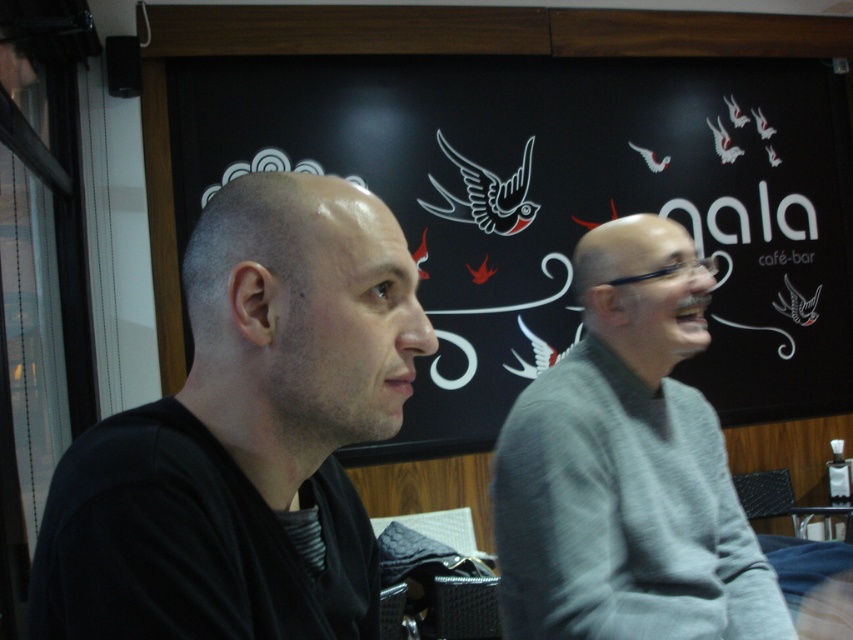
Question: Estimate the real-world distances between objects in this image. Which object is closer to the black matte shirt at left?

Choices:
 (A) black matte/blackboard at upper center
 (B) gray wool sweater at right
 (C) black plastic table at lower right

Answer: (B)

Question: Considering the relative positions of gray wool sweater at right and black plastic table at lower right in the image provided, where is gray wool sweater at right located with respect to black plastic table at lower right?

Choices:
 (A) left
 (B) right

Answer: (A)

Question: Does black matte/blackboard at upper center appear under gray wool sweater at right?

Choices:
 (A) yes
 (B) no

Answer: (B)

Question: Which object is positioned farthest from the black matte shirt at left?

Choices:
 (A) black plastic table at lower right
 (B) gray wool sweater at right
 (C) black matte/blackboard at upper center

Answer: (A)

Question: Which object is closer to the camera taking this photo?

Choices:
 (A) black matte/blackboard at upper center
 (B) black matte shirt at left

Answer: (B)

Question: From the image, what is the correct spatial relationship of black matte/blackboard at upper center in relation to gray wool sweater at right?

Choices:
 (A) left
 (B) right

Answer: (B)